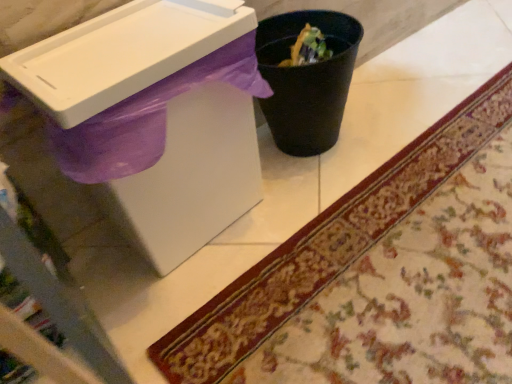
Question: Considering the relative sizes of carpeted mat at lower right and black plastic trash can at center in the image provided, is carpeted mat at lower right smaller than black plastic trash can at center?

Choices:
 (A) no
 (B) yes

Answer: (B)

Question: From a real-world perspective, is carpeted mat at lower right on black plastic trash can at center?

Choices:
 (A) no
 (B) yes

Answer: (A)

Question: From the image's perspective, would you say carpeted mat at lower right is positioned over black plastic trash can at center?

Choices:
 (A) no
 (B) yes

Answer: (A)

Question: Is carpeted mat at lower right behind black plastic trash can at center?

Choices:
 (A) no
 (B) yes

Answer: (A)

Question: Considering the relative sizes of carpeted mat at lower right and black plastic trash can at center in the image provided, is carpeted mat at lower right taller than black plastic trash can at center?

Choices:
 (A) no
 (B) yes

Answer: (A)

Question: Do you think white plastic sink at upper left is within black plastic trash can at center, or outside of it?

Choices:
 (A) outside
 (B) inside

Answer: (A)

Question: From a real-world perspective, relative to black plastic trash can at center, is white plastic sink at upper left vertically above or below?

Choices:
 (A) below
 (B) above

Answer: (B)

Question: Does point (128, 102) appear closer or farther from the camera than point (330, 39)?

Choices:
 (A) farther
 (B) closer

Answer: (B)

Question: Is white plastic sink at upper left taller or shorter than black plastic trash can at center?

Choices:
 (A) short
 (B) tall

Answer: (B)

Question: Do you think white plastic sink at upper left is within carpeted mat at lower right, or outside of it?

Choices:
 (A) inside
 (B) outside

Answer: (B)

Question: Relative to carpeted mat at lower right, is white plastic sink at upper left in front or behind?

Choices:
 (A) front
 (B) behind

Answer: (B)

Question: Is white plastic sink at upper left to the left or to the right of carpeted mat at lower right in the image?

Choices:
 (A) left
 (B) right

Answer: (A)

Question: From a real-world perspective, relative to carpeted mat at lower right, is white plastic sink at upper left vertically above or below?

Choices:
 (A) below
 (B) above

Answer: (B)

Question: Is point (322, 264) positioned closer to the camera than point (168, 96)?

Choices:
 (A) farther
 (B) closer

Answer: (A)

Question: Is carpeted mat at lower right to the left or to the right of white plastic sink at upper left in the image?

Choices:
 (A) left
 (B) right

Answer: (B)